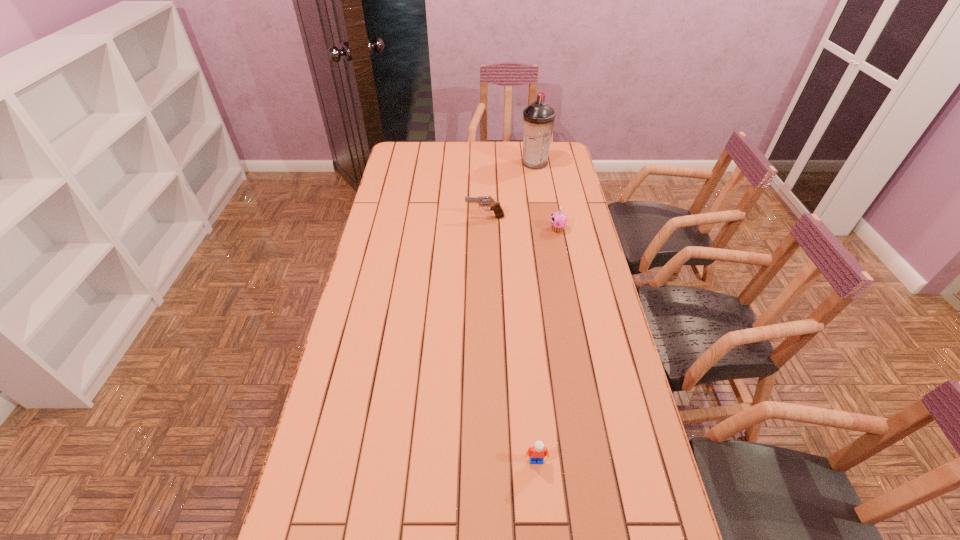
This screenshot has width=960, height=540. In order to click on free spot located 0.180m on the face of the third farthest object in this screenshot , I will do `click(503, 229)`.

Where is `free region located 0.080m at the barrel of the third nearest object`? free region located 0.080m at the barrel of the third nearest object is located at coordinates (445, 217).

Where is `free space located 0.290m at the barrel of the third nearest object`? The image size is (960, 540). free space located 0.290m at the barrel of the third nearest object is located at coordinates (394, 217).

This screenshot has height=540, width=960. What are the coordinates of `free spot located at the barrel of the third nearest object` in the screenshot? It's located at (414, 217).

At what (x,y) coordinates should I click in order to perform the action: click on vacant space located 0.050m on the face of the Lego. Please return your answer as a coordinate pair (x, y). This screenshot has width=960, height=540. Looking at the image, I should click on tap(539, 485).

This screenshot has height=540, width=960. What are the coordinates of `object located in the far edge section of the desktop` in the screenshot? It's located at (538, 118).

This screenshot has width=960, height=540. What are the coordinates of `aerosol can at the right edge` in the screenshot? It's located at (538, 118).

The image size is (960, 540). Find the location of `cupcake located in the right edge section of the desktop`. cupcake located in the right edge section of the desktop is located at coordinates (558, 220).

You are a GUI agent. You are given a task and a screenshot of the screen. Output one action in this format:
    pyautogui.click(x=<x>, y=<y>)
    Task: Click on the object at the far right corner
    The width and height of the screenshot is (960, 540).
    Given the screenshot: What is the action you would take?
    pyautogui.click(x=538, y=118)

Where is `free space at the far edge of the desktop`? free space at the far edge of the desktop is located at coordinates (497, 150).